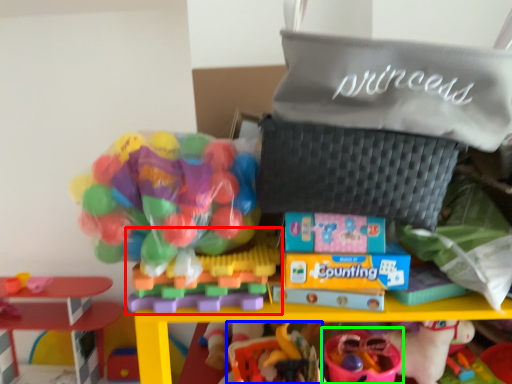
Question: Considering the real-world distances, which object is farthest from toy (highlighted by a red box)? toy (highlighted by a blue box) or toy (highlighted by a green box)?

Choices:
 (A) toy
 (B) toy

Answer: (B)